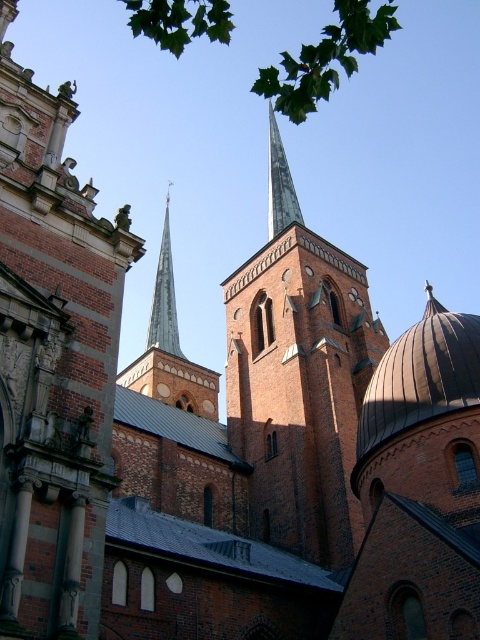
Question: Is brown stone tower at upper center to the left of metallic gray dome at right from the viewer's perspective?

Choices:
 (A) yes
 (B) no

Answer: (A)

Question: Which point is farther to the camera?

Choices:
 (A) pyautogui.click(x=226, y=38)
 (B) pyautogui.click(x=153, y=339)
 (C) pyautogui.click(x=295, y=381)
 (D) pyautogui.click(x=171, y=316)

Answer: (D)

Question: Is brown stone tower at upper center closer to the viewer compared to green leafy tree at upper center?

Choices:
 (A) no
 (B) yes

Answer: (A)

Question: Does brown brick tower at center have a greater width compared to metallic gray dome at right?

Choices:
 (A) yes
 (B) no

Answer: (A)

Question: Which is farther from the green leafy tree at upper center?

Choices:
 (A) metallic gray dome at right
 (B) brick steeple at center
 (C) brown brick tower at center

Answer: (A)

Question: Among these objects, which one is farthest from the camera?

Choices:
 (A) brown stone tower at upper center
 (B) brown brick tower at center
 (C) brick steeple at center

Answer: (C)